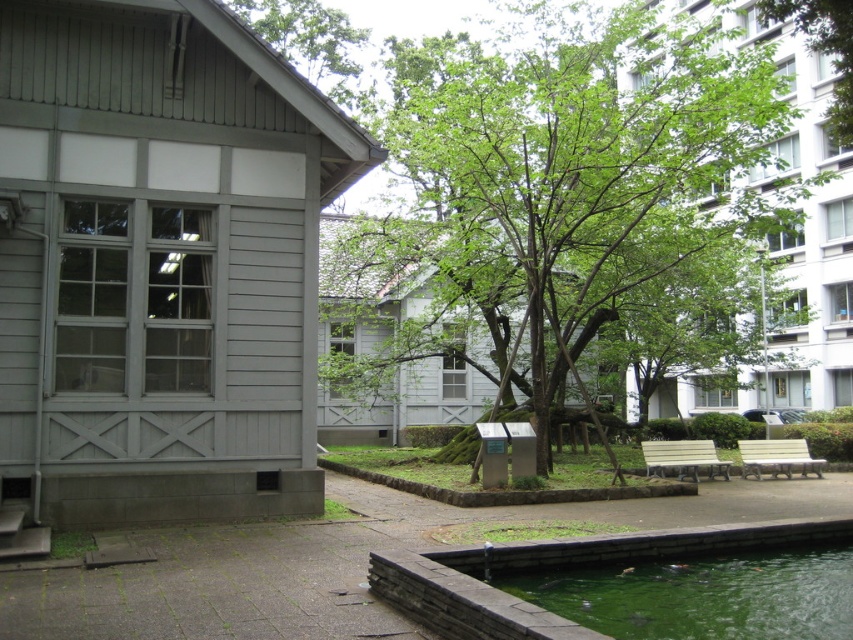
You are standing at the point with coordinates (x=572, y=192) in the image. What object is directly beneath your feet?

The green leafy tree at center is located at point (x=572, y=192), so the object directly beneath your feet is the green leafy tree at center.

You are standing at the light beige wooden bench at lower right and want to water the green leafy tree at center using a hose that can extend up to 10 meters. Can you reach the tree with the hose?

The green leafy tree at center is 10.55 meters away from the light beige wooden bench at lower right. Since the hose can only extend up to 10 meters, you cannot reach the tree with the hose.